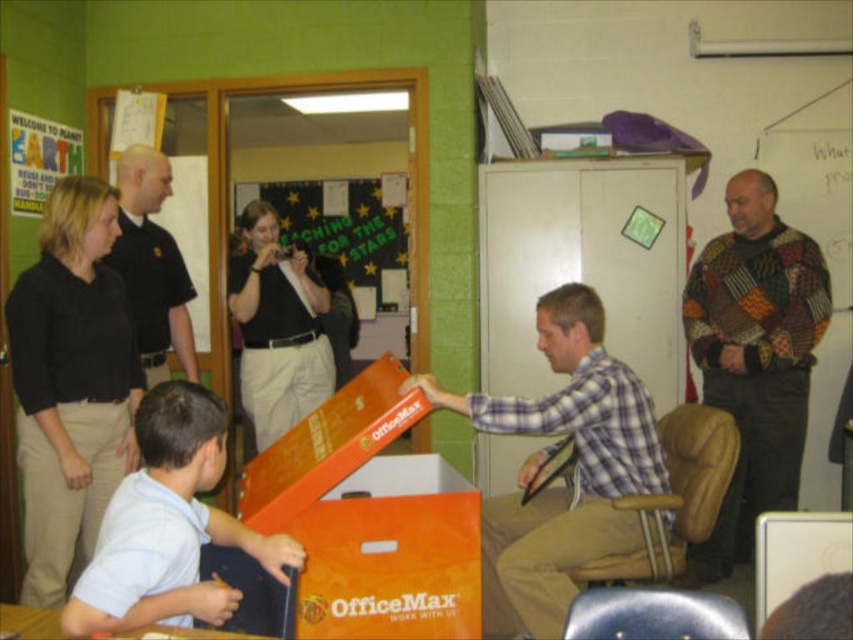
Based on the photo, you are organizing a classroom and need to place a new poster between the orange cardboard box at center and the light blue shirt at lower left. Based on their positions, which object should the poster be closer to?

The orange cardboard box at center is positioned on the right side of the light blue shirt at lower left, so the poster should be placed closer to the light blue shirt at lower left to maintain spatial alignment.

You are a student trying to reach the orange cardboard box at center to grab your notes. There is a light blue shirt at lower left in the way. Can you move around it to get to the box?

The orange cardboard box at center is further to the viewer than the light blue shirt at lower left, so you can move around the light blue shirt at lower left to reach the box.

You are organizing a classroom and need to place the orange cardboard box at center and the light blue shirt at lower left. Given their sizes, which object requires more space?

The orange cardboard box at center requires more space because it is bigger than the light blue shirt at lower left.